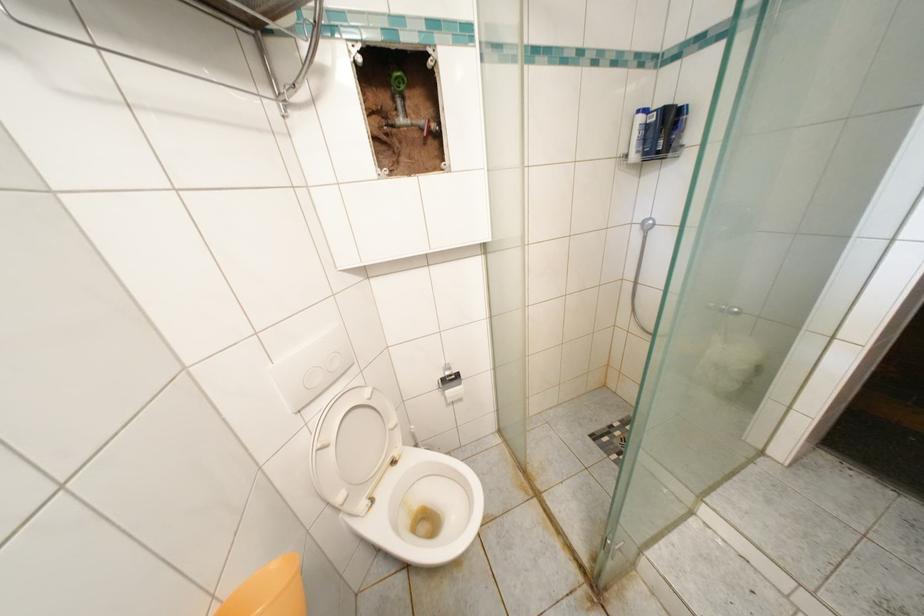
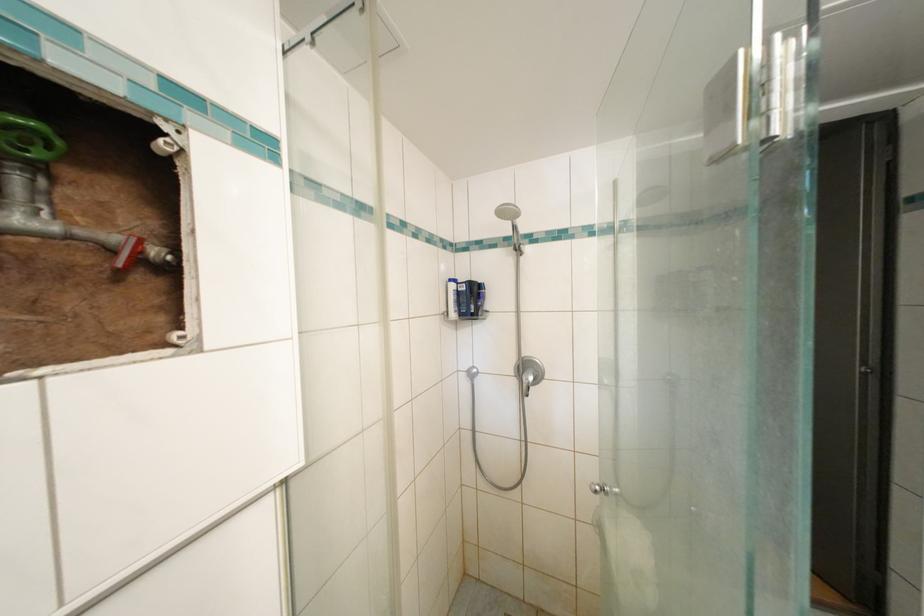
The first image is from the beginning of the video and the second image is from the end. How did the camera likely rotate when shooting the video?

The camera's rotation is toward right-up.